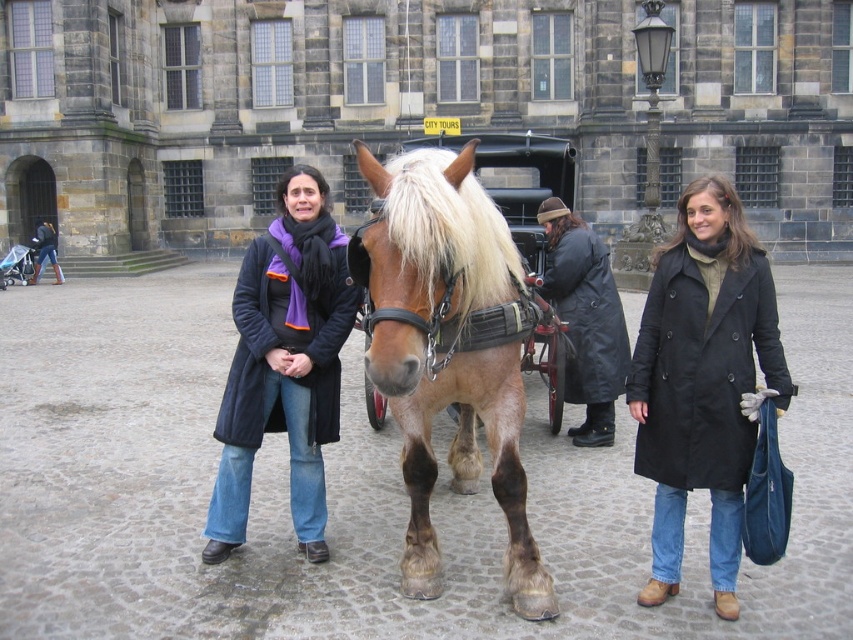
The height and width of the screenshot is (640, 853). Describe the element at coordinates (445, 349) in the screenshot. I see `brown glossy horse at center` at that location.

Is point (396, 192) positioned in front of point (595, 403)?

Yes, it is in front of point (595, 403).

Who is more forward, (399, 308) or (569, 397)?

Point (399, 308)

At what (x,y) coordinates should I click in order to perform the action: click on brown glossy horse at center. Please return your answer as a coordinate pair (x, y). The height and width of the screenshot is (640, 853). Looking at the image, I should click on (445, 349).

Is black coat at center shorter than matte black coat at center?

Indeed, black coat at center has a lesser height compared to matte black coat at center.

Which is above, black coat at center or matte black coat at center?

matte black coat at center

Does point (693, 397) come closer to viewer compared to point (296, 509)?

That is True.

Identify the location of black coat at center. (703, 381).

Is brown glossy horse at center below black coat at center?

Incorrect, brown glossy horse at center is not positioned below black coat at center.

Where is `brown glossy horse at center`? brown glossy horse at center is located at coordinates (445, 349).

You are a GUI agent. You are given a task and a screenshot of the screen. Output one action in this format:
    pyautogui.click(x=<x>, y=<y>)
    Task: Click on the brown glossy horse at center
    This screenshot has height=640, width=853.
    Given the screenshot: What is the action you would take?
    pyautogui.click(x=445, y=349)